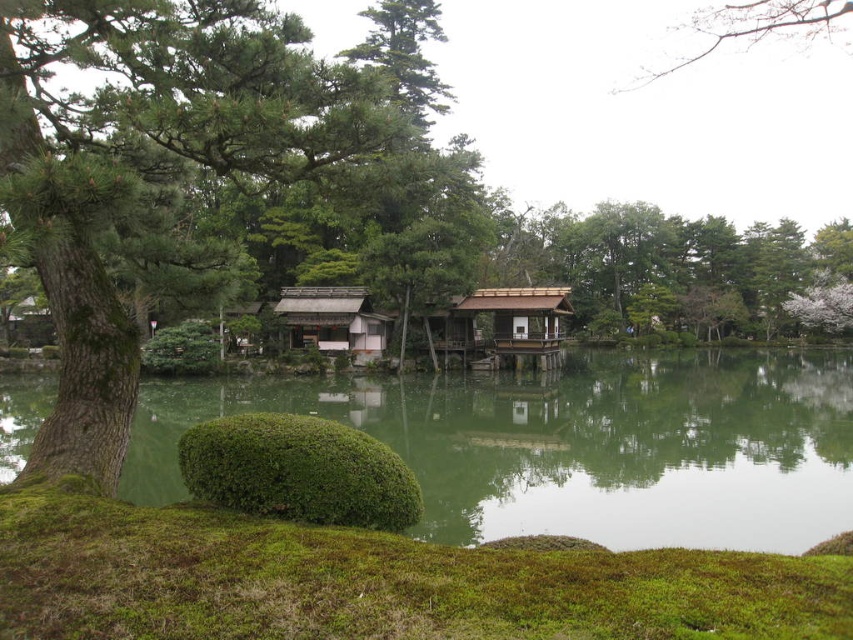
Question: Which point is farther from the camera taking this photo?

Choices:
 (A) (x=521, y=356)
 (B) (x=456, y=426)
 (C) (x=323, y=314)

Answer: (A)

Question: Does green reflective water at center have a smaller size compared to brown wooden hut at center?

Choices:
 (A) yes
 (B) no

Answer: (B)

Question: Which object is farther from the camera taking this photo?

Choices:
 (A) wooden shingled hut at center
 (B) green reflective water at center
 (C) bare branches at upper right

Answer: (A)

Question: Is green reflective water at center smaller than brown wooden hut at center?

Choices:
 (A) no
 (B) yes

Answer: (A)

Question: Does bare branches at upper right appear on the left side of brown wooden hut at center?

Choices:
 (A) yes
 (B) no

Answer: (B)

Question: Which object is farther from the camera taking this photo?

Choices:
 (A) bare branches at upper right
 (B) wooden shingled hut at center
 (C) green reflective water at center
 (D) brown wooden hut at center

Answer: (D)